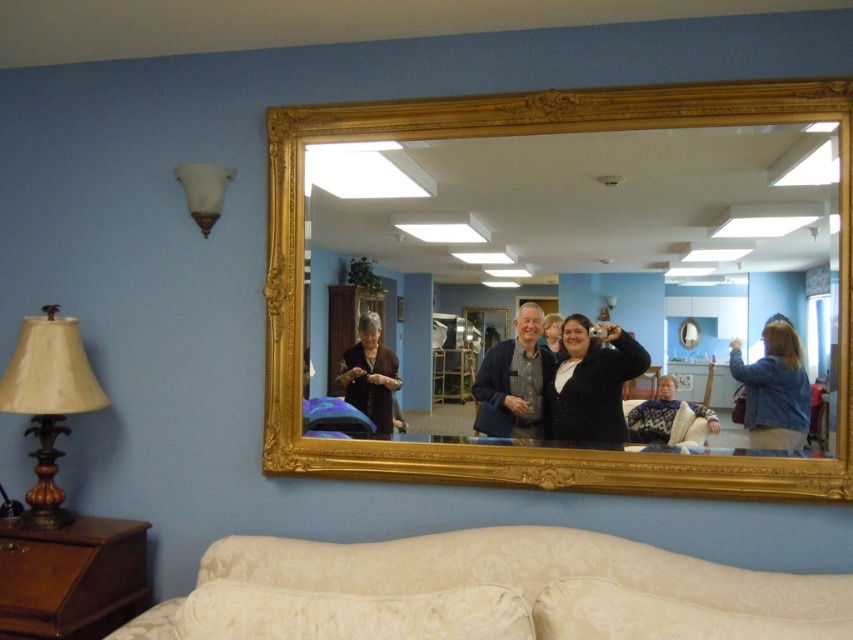
Does creamy fabric couch at lower center have a smaller size compared to matte beige lampshade at left?

Incorrect, creamy fabric couch at lower center is not smaller in size than matte beige lampshade at left.

You are a GUI agent. You are given a task and a screenshot of the screen. Output one action in this format:
    pyautogui.click(x=<x>, y=<y>)
    Task: Click on the creamy fabric couch at lower center
    The image size is (853, 640).
    Given the screenshot: What is the action you would take?
    pyautogui.click(x=489, y=592)

Who is more distant from viewer, (28, 376) or (576, 440)?

The point (576, 440) is behind.

Is the position of matte beige lampshade at left more distant than that of matte black sweater at center?

That is False.

Identify the location of matte beige lampshade at left. The height and width of the screenshot is (640, 853). (48, 403).

Based on the photo, does gold ornate mirror at upper center have a larger size compared to matte black sweater at center?

Indeed, gold ornate mirror at upper center has a larger size compared to matte black sweater at center.

Locate an element on the screen. The height and width of the screenshot is (640, 853). gold ornate mirror at upper center is located at coordinates (526, 132).

Identify the location of gold ornate mirror at upper center. The image size is (853, 640). (526, 132).